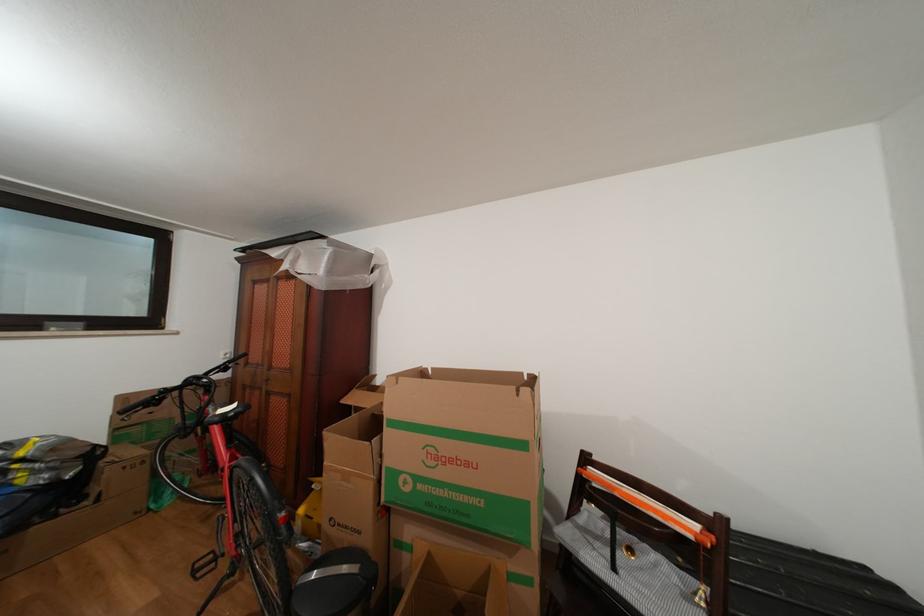
At what (x,y) coordinates should I click in order to perform the action: click on black bicycle pedal. Please return your answer as a coordinate pair (x, y). Image resolution: width=924 pixels, height=616 pixels. Looking at the image, I should click on (203, 565).